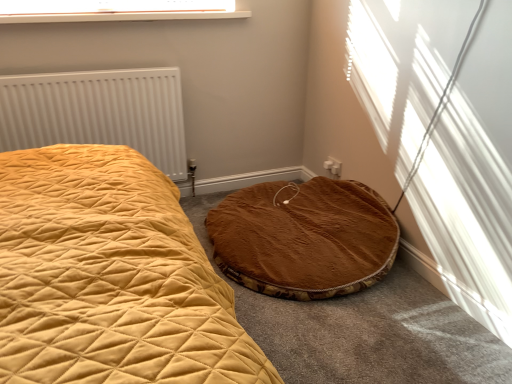
Question: Is brown plush cat bed at lower right to the left or to the right of white textured radiator at left in the image?

Choices:
 (A) left
 (B) right

Answer: (B)

Question: From a real-world perspective, is brown plush cat bed at lower right positioned above or below white textured radiator at left?

Choices:
 (A) below
 (B) above

Answer: (A)

Question: Which object is positioned farthest from the brown plush cat bed at lower right?

Choices:
 (A) white textured radiator at left
 (B) clear plastic window screen at upper center

Answer: (B)

Question: Estimate the real-world distances between objects in this image. Which object is farther from the white textured radiator at left?

Choices:
 (A) clear plastic window screen at upper center
 (B) brown plush cat bed at lower right

Answer: (B)